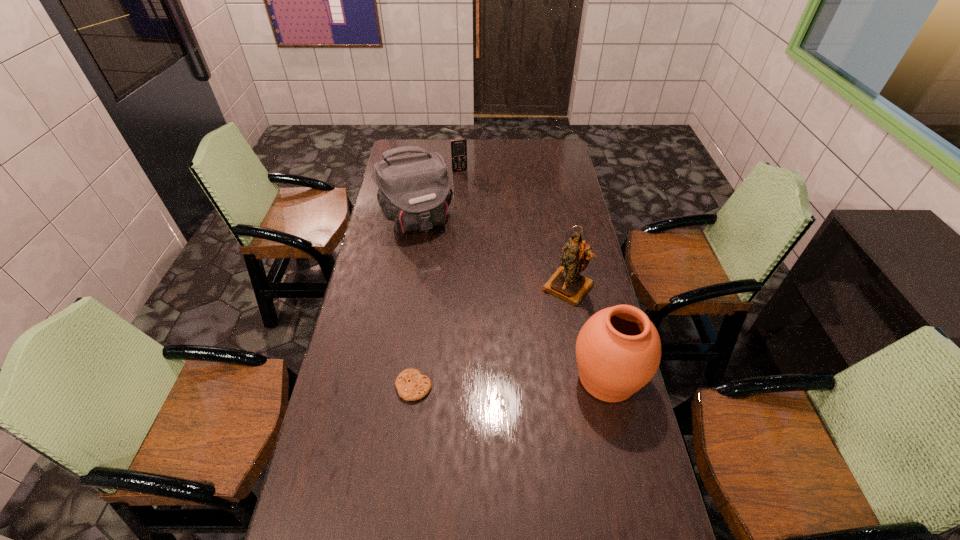
Locate an element on the screen. vacant space on the desktop that is between the shortest object and the urn and is positioned on the front-facing side of the figurine is located at coordinates (485, 383).

Locate an element on the screen. The image size is (960, 540). vacant space on the desktop that is between the shortest object and the urn and is positioned on the open flap of the shoulder bag is located at coordinates (489, 383).

This screenshot has height=540, width=960. Identify the location of free space on the desktop that is between the cookie and the urn and is positioned on the screen of the second shortest object. (x=538, y=381).